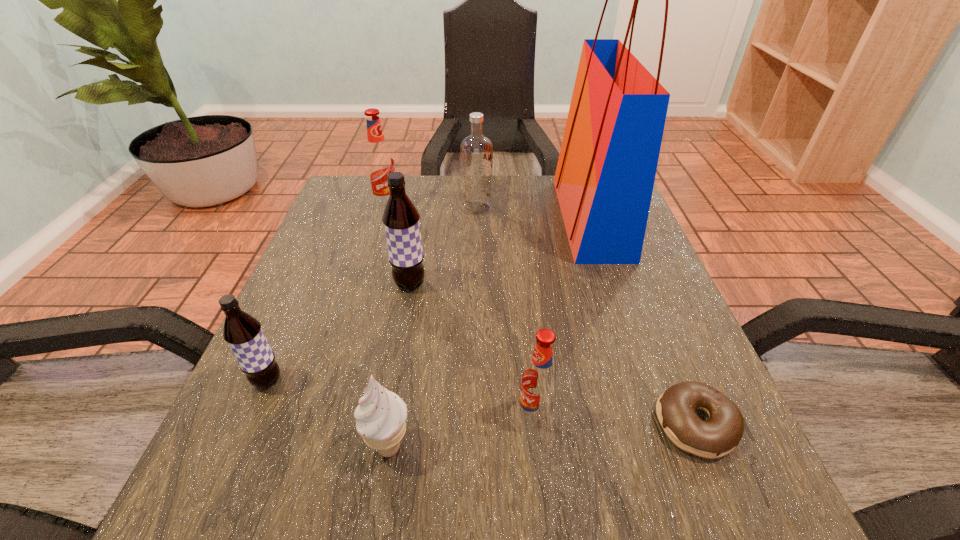
Identify the location of vacant space located on the left of the nearer red root beer. (485, 416).

Locate an element on the screen. free space located 0.070m on the back of the left brown root beer is located at coordinates coord(287,336).

Locate an element on the screen. Image resolution: width=960 pixels, height=540 pixels. free space located 0.190m on the front-facing side of the icecream is located at coordinates (548, 447).

Locate an element on the screen. free space located 0.080m on the left of the brown doughnut is located at coordinates (602, 424).

Identify the location of shopping bag that is positioned at the far edge. This screenshot has height=540, width=960. (604, 180).

You are a GUI agent. You are given a task and a screenshot of the screen. Output one action in this format:
    pyautogui.click(x=<x>, y=<y>)
    Task: Click on the root beer that is at the far edge
    
    Given the screenshot: What is the action you would take?
    pyautogui.click(x=379, y=161)

Image resolution: width=960 pixels, height=540 pixels. I want to click on vodka that is positioned at the far edge, so click(x=476, y=151).

Locate an element on the screen. The width and height of the screenshot is (960, 540). object at the near edge is located at coordinates (381, 415).

This screenshot has width=960, height=540. Identify the location of shopping bag located at the right edge. (604, 180).

Identify the location of doughnut present at the right edge. (675, 408).